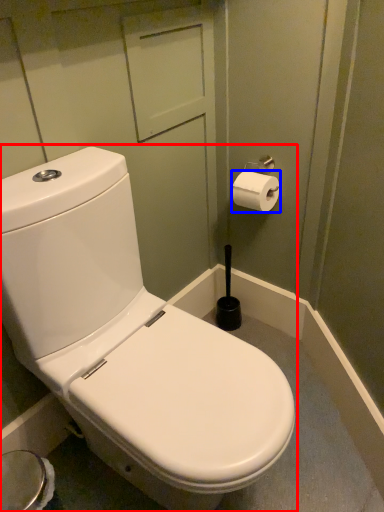
Question: Among these objects, which one is farthest to the camera, toilet (highlighted by a red box) or toilet paper (highlighted by a blue box)?

Choices:
 (A) toilet
 (B) toilet paper

Answer: (B)